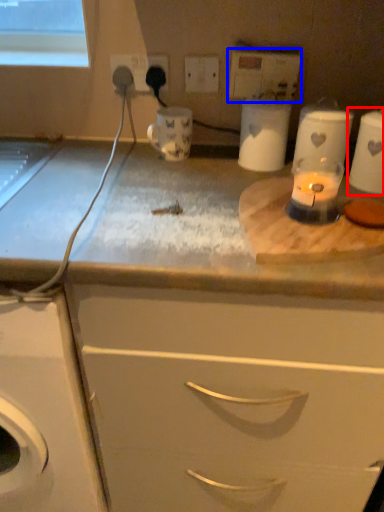
Question: Which point is further to the camera, appliance (highlighted by a red box) or electric outlet (highlighted by a blue box)?

Choices:
 (A) appliance
 (B) electric outlet

Answer: (B)